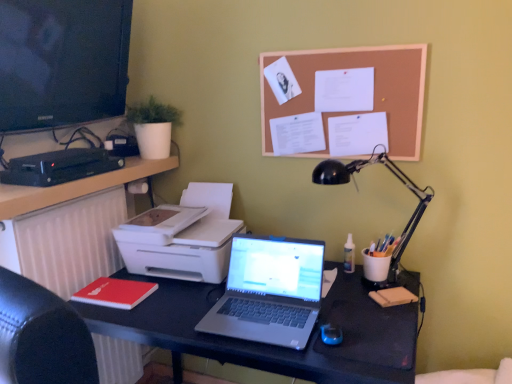
Question: Could you tell me if white plastic printer at left is turned towards silver metallic laptop at center?

Choices:
 (A) no
 (B) yes

Answer: (A)

Question: Is white plastic printer at left turned away from silver metallic laptop at center?

Choices:
 (A) yes
 (B) no

Answer: (B)

Question: Considering the relative sizes of white plastic printer at left and silver metallic laptop at center in the image provided, is white plastic printer at left bigger than silver metallic laptop at center?

Choices:
 (A) no
 (B) yes

Answer: (B)

Question: From the image's perspective, is white plastic printer at left located beneath silver metallic laptop at center?

Choices:
 (A) yes
 (B) no

Answer: (B)

Question: Does white plastic printer at left touch silver metallic laptop at center?

Choices:
 (A) yes
 (B) no

Answer: (B)

Question: Can you confirm if white plastic printer at left is wider than silver metallic laptop at center?

Choices:
 (A) yes
 (B) no

Answer: (A)

Question: Is corkboard at upper center thinner than white matte radiator at left?

Choices:
 (A) no
 (B) yes

Answer: (B)

Question: Is corkboard at upper center with white matte radiator at left?

Choices:
 (A) yes
 (B) no

Answer: (B)

Question: From the image's perspective, is corkboard at upper center below white matte radiator at left?

Choices:
 (A) yes
 (B) no

Answer: (B)

Question: Does corkboard at upper center appear on the left side of white matte radiator at left?

Choices:
 (A) no
 (B) yes

Answer: (A)

Question: Is corkboard at upper center further to the viewer compared to white matte radiator at left?

Choices:
 (A) no
 (B) yes

Answer: (B)

Question: From a real-world perspective, is corkboard at upper center located higher than white matte radiator at left?

Choices:
 (A) no
 (B) yes

Answer: (B)

Question: Can you confirm if black matte desk at center is shorter than white matte radiator at left?

Choices:
 (A) no
 (B) yes

Answer: (B)